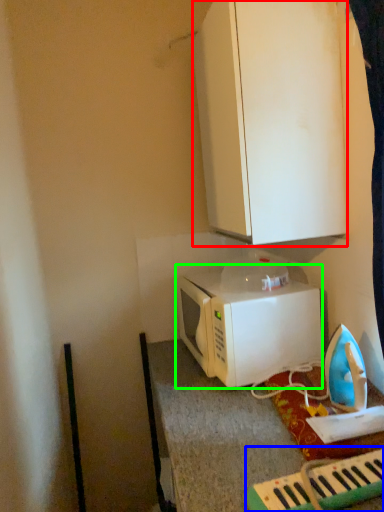
Question: Estimate the real-world distances between objects in this image. Which object is farther from cabinetry (highlighted by a red box), musical keyboard (highlighted by a blue box) or microwave oven (highlighted by a green box)?

Choices:
 (A) musical keyboard
 (B) microwave oven

Answer: (A)